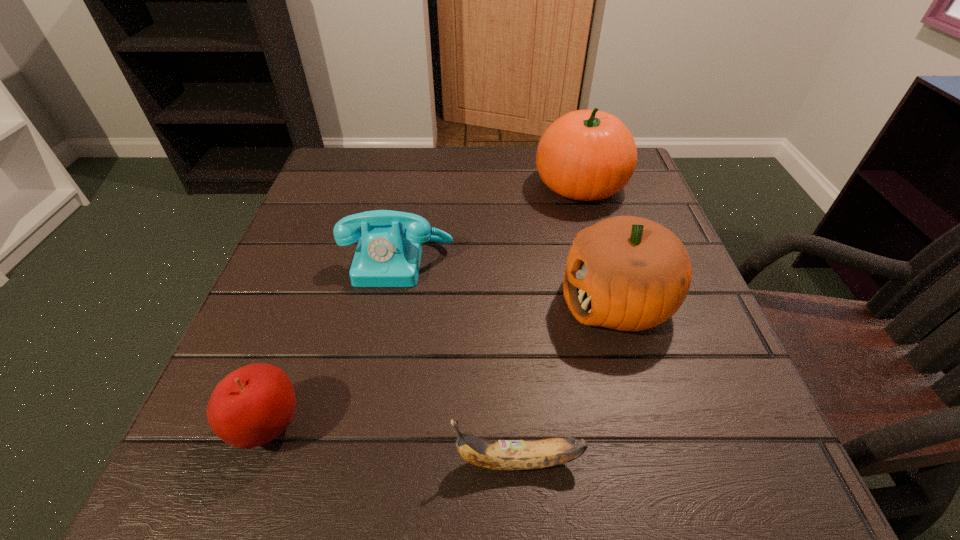
Locate an element on the screen. This screenshot has width=960, height=540. object that is positioned at the far right corner is located at coordinates pos(586,155).

Identify the location of vacant region at the far edge of the desktop. (525, 163).

This screenshot has height=540, width=960. In the image, there is a desktop. In order to click on vacant space at the near edge in this screenshot , I will do `click(655, 482)`.

In the image, there is a desktop. In order to click on vacant space at the left edge in this screenshot , I will do `click(252, 310)`.

Locate an element on the screen. The image size is (960, 540). free space at the right edge is located at coordinates (670, 408).

The height and width of the screenshot is (540, 960). In the image, there is a desktop. Identify the location of vacant area at the far left corner. click(356, 178).

Locate an element on the screen. vacant point located between the telephone and the banana is located at coordinates (458, 361).

I want to click on free space between the apple and the shortest object, so click(393, 444).

Find the location of a particular element. The width and height of the screenshot is (960, 540). vacant region between the apple and the telephone is located at coordinates (333, 343).

What are the coordinates of `unoccupied position between the telephone and the nearer pumpkin` in the screenshot? It's located at (508, 281).